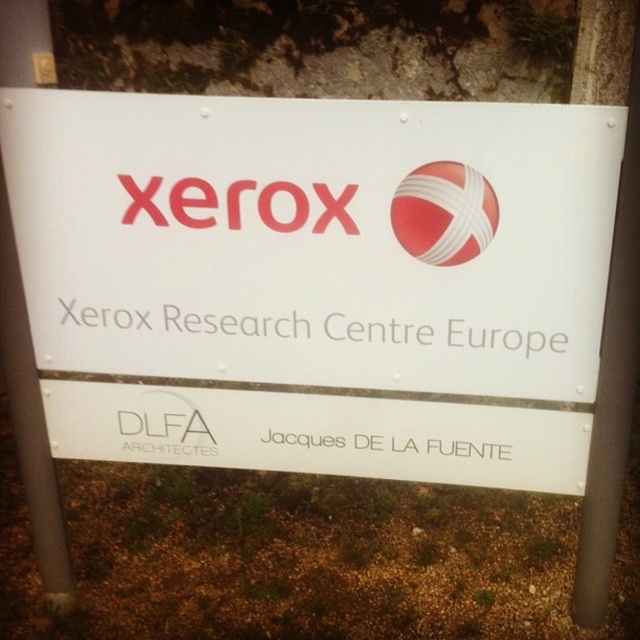
Can you confirm if red glossy sphere at center is bigger than matte red xerox logo at center?

Incorrect, red glossy sphere at center is not larger than matte red xerox logo at center.

I want to click on red glossy sphere at center, so click(x=444, y=212).

In order to click on red glossy sphere at center in this screenshot , I will do `click(444, 212)`.

Is white metal pole at center below matte red xerox logo at center?

Yes, white metal pole at center is below matte red xerox logo at center.

Who is shorter, white metal pole at center or matte red xerox logo at center?

matte red xerox logo at center is shorter.

You are a GUI agent. You are given a task and a screenshot of the screen. Output one action in this format:
    pyautogui.click(x=<x>, y=<y>)
    Task: Click on the white metal pole at center
    Image resolution: width=640 pixels, height=640 pixels.
    Given the screenshot: What is the action you would take?
    [29, 419]

Can you confirm if white metal pole at center is positioned to the right of red glossy sphere at center?

Incorrect, white metal pole at center is not on the right side of red glossy sphere at center.

Who is higher up, white metal pole at center or red glossy sphere at center?

red glossy sphere at center

Between point (36, 436) and point (417, 176), which one is positioned behind?

The point (36, 436) is more distant.

What are the coordinates of `white metal pole at center` in the screenshot? It's located at (29, 419).